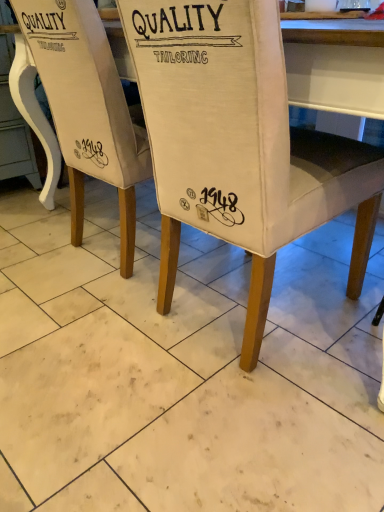
Locate an element on the screen. free space in front of canvas chair at center, arranged as the second chair when viewed from the right is located at coordinates (79, 323).